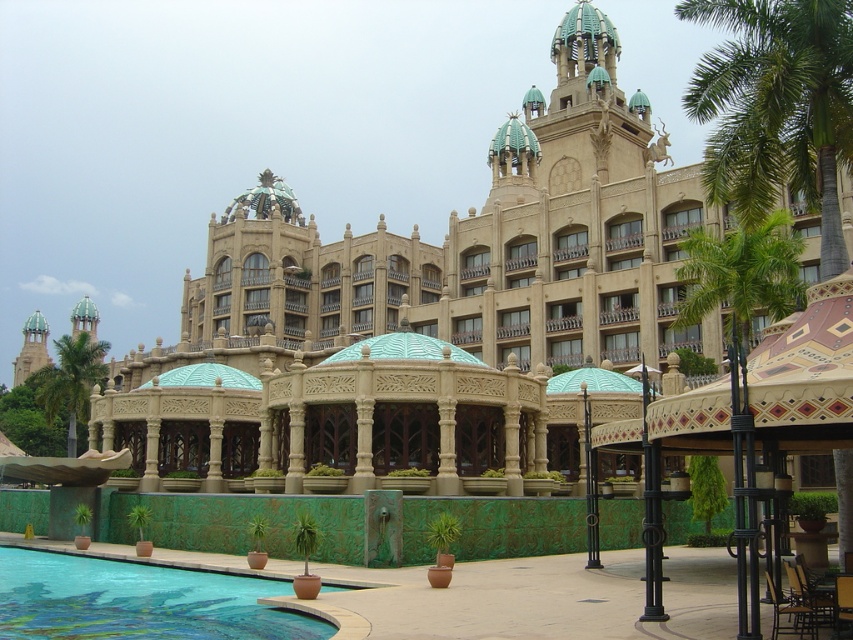
Is green leafy palm tree at upper right to the right of blue mosaic tiles at lower left from the viewer's perspective?

Yes, green leafy palm tree at upper right is to the right of blue mosaic tiles at lower left.

This screenshot has width=853, height=640. What do you see at coordinates (776, 106) in the screenshot? I see `green leafy palm tree at upper right` at bounding box center [776, 106].

Identify the location of green leafy palm tree at upper right. The image size is (853, 640). (776, 106).

Which is above, green leafy palm tree at upper right or green leafy palm tree at left?

Positioned higher is green leafy palm tree at upper right.

Between green leafy palm tree at upper right and green leafy palm tree at left, which one appears on the left side from the viewer's perspective?

green leafy palm tree at left

Who is more forward, (784,180) or (79,388)?

Positioned in front is point (784,180).

You are a GUI agent. You are given a task and a screenshot of the screen. Output one action in this format:
    pyautogui.click(x=<x>, y=<y>)
    Task: Click on the green leafy palm tree at upper right
    This screenshot has width=853, height=640.
    Given the screenshot: What is the action you would take?
    pyautogui.click(x=776, y=106)

Is blue mosaic tiles at lower left to the right of green leafy palm tree at left from the viewer's perspective?

Correct, you'll find blue mosaic tiles at lower left to the right of green leafy palm tree at left.

Consider the image. Can you confirm if blue mosaic tiles at lower left is shorter than green leafy palm tree at left?

Indeed, blue mosaic tiles at lower left has a lesser height compared to green leafy palm tree at left.

In order to click on blue mosaic tiles at lower left in this screenshot , I will do `click(142, 600)`.

Locate an element on the screen. blue mosaic tiles at lower left is located at coordinates (142, 600).